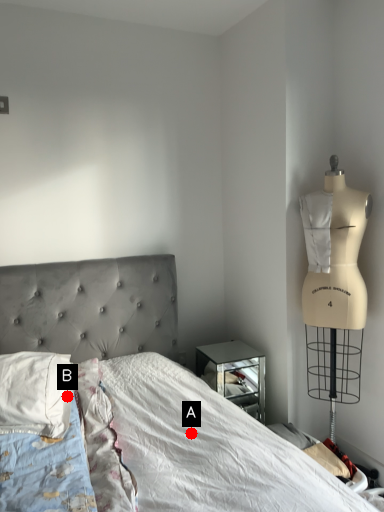
Question: Two points are circled on the image, labeled by A and B beside each circle. Which point is closer to the camera?

Choices:
 (A) A is closer
 (B) B is closer

Answer: (A)